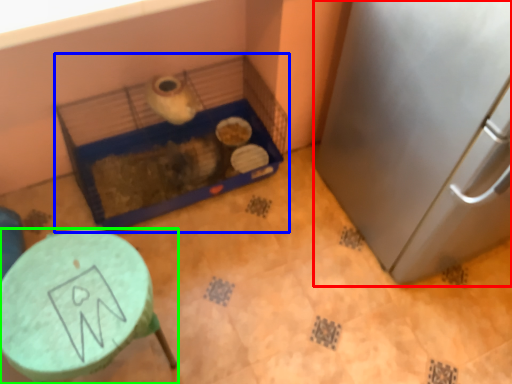
Question: Estimate the real-world distances between objects in this image. Which object is farther from appliance (highlighted by a red box), bird cage (highlighted by a blue box) or furniture (highlighted by a green box)?

Choices:
 (A) bird cage
 (B) furniture

Answer: (B)